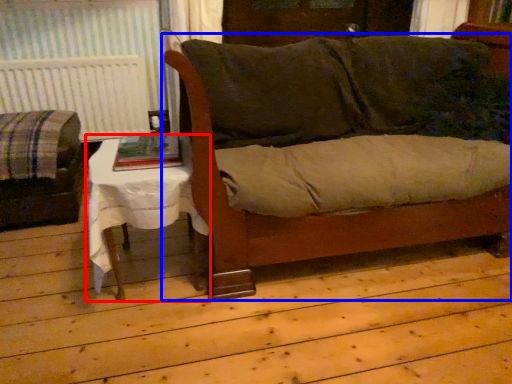
Question: Which of the following is the closest to the observer, table (highlighted by a red box) or couch (highlighted by a blue box)?

Choices:
 (A) table
 (B) couch

Answer: (B)